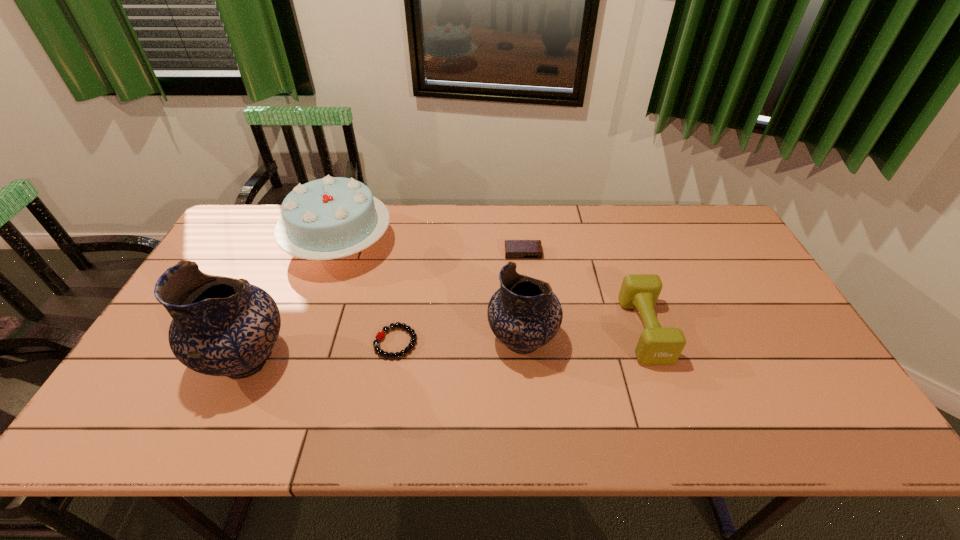
In the current image, all potterys are evenly spaced. To maintain this equal spacing, where should an additional pottery be placed on the right? Please point out a free spot. Please provide its 2D coordinates. Your answer should be formatted as a tuple, i.e. [(x, y)], where the tuple contains the x and y coordinates of a point satisfying the conditions above.

[(777, 321)]